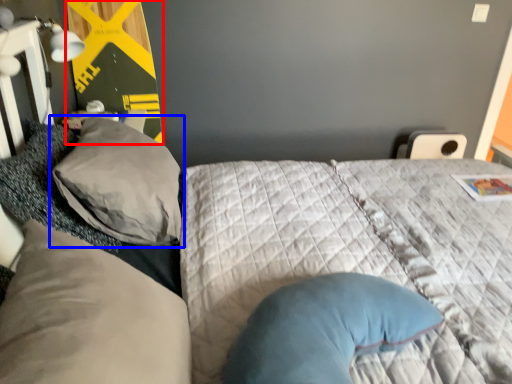
Question: Which object is closer to the camera taking this photo, bulletin board (highlighted by a red box) or pillow (highlighted by a blue box)?

Choices:
 (A) bulletin board
 (B) pillow

Answer: (B)